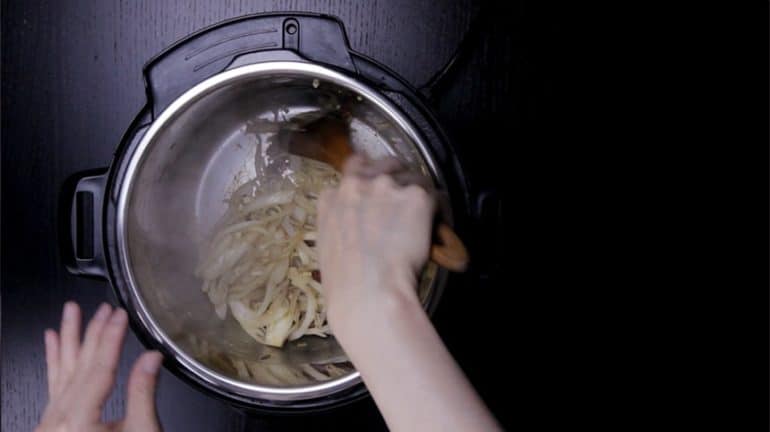
The height and width of the screenshot is (432, 770). Identify the location of spoon. (333, 137).